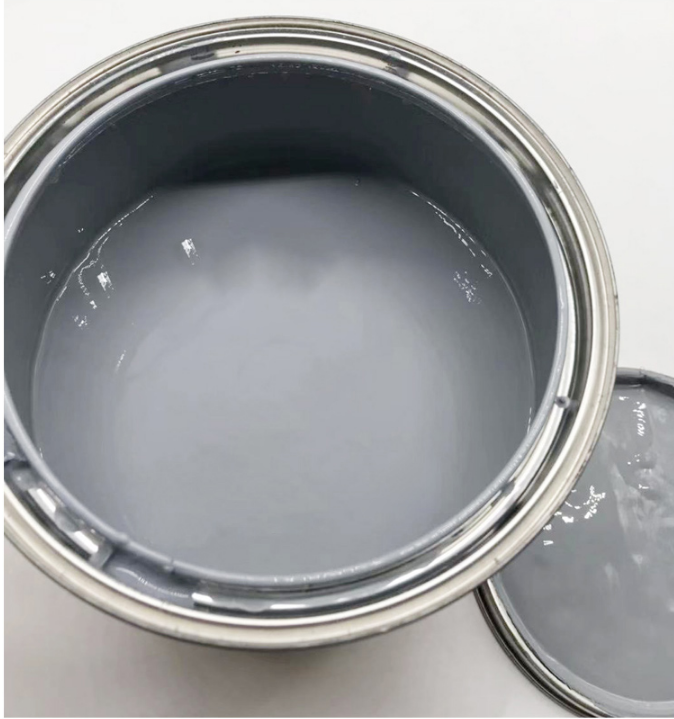
The image size is (674, 719). Find the location of `gray paint`. gray paint is located at coordinates (446, 471).